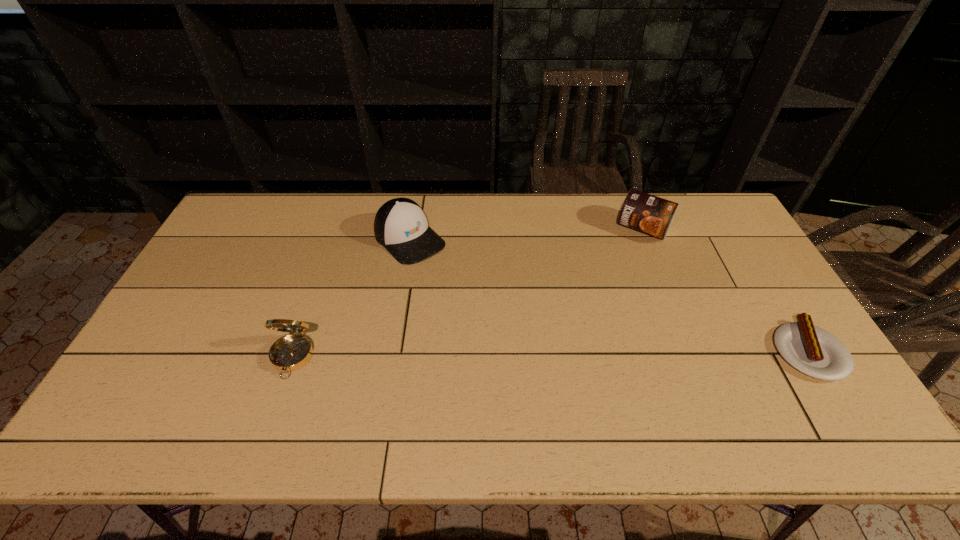
Locate an element on the screen. The width and height of the screenshot is (960, 540). compass is located at coordinates (291, 352).

I want to click on sausage, so click(x=814, y=351).

Locate an element on the screen. The width and height of the screenshot is (960, 540). the shortest object is located at coordinates (814, 351).

Image resolution: width=960 pixels, height=540 pixels. I want to click on the third object from left to right, so click(x=647, y=213).

Locate an element on the screen. The width and height of the screenshot is (960, 540). cap is located at coordinates (400, 226).

Find the location of a particular element. free space located 0.050m on the left of the rightmost object is located at coordinates click(755, 351).

This screenshot has width=960, height=540. What are the coordinates of `vacant space located on the front label of the can` in the screenshot? It's located at (585, 325).

The width and height of the screenshot is (960, 540). Identify the location of blank area located on the front label of the can. (602, 295).

The height and width of the screenshot is (540, 960). Find the location of `vacant space located on the front label of the can`. vacant space located on the front label of the can is located at coordinates (585, 325).

The width and height of the screenshot is (960, 540). Find the location of `vacant space located 0.160m on the front panel of the third object from right to left`. vacant space located 0.160m on the front panel of the third object from right to left is located at coordinates (461, 288).